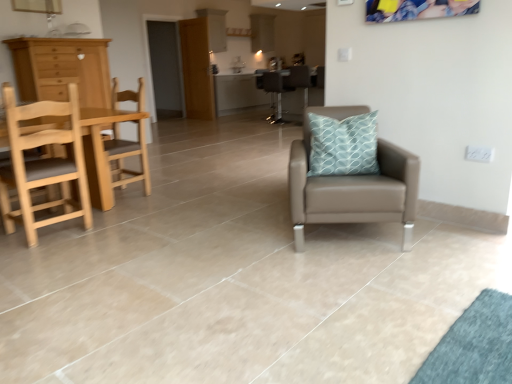
Question: Considering the positions of leather armchair at center, the 5th chair positioned from the left, and metallic silver table at center, the first table viewed from the back, in the image, is leather armchair at center, the 5th chair positioned from the left, bigger or smaller than metallic silver table at center, the first table viewed from the back,?

Choices:
 (A) small
 (B) big

Answer: (A)

Question: Is leather armchair at center, arranged as the first chair when viewed from the right, in front of or behind metallic silver table at center, acting as the 2th table starting from the front, in the image?

Choices:
 (A) behind
 (B) front

Answer: (B)

Question: Which object is positioned closest to the brown leather armchair at center?

Choices:
 (A) leather armchair at center, which ranks as the 4th chair in left-to-right order
 (B) leather armchair at center, which is counted as the 4th chair, starting from the front
 (C) light blue textured cushion at center
 (D) metallic silver table at center, positioned as the 2th table in bottom-to-top order
 (E) metallic silver stool at center, which is the 5th chair in front-to-back order

Answer: (E)

Question: Considering the real-world distances, which object is farthest from the transparent glass door at center?

Choices:
 (A) metallic silver table at center, the 1th table positioned from the top
 (B) light wood/woodenobject at left
 (C) metallic silver stool at center, which is the third chair in left-to-right order
 (D) brown leather armchair at center
 (E) leather armchair at center, marked as the fifth chair in a back-to-front arrangement

Answer: (E)